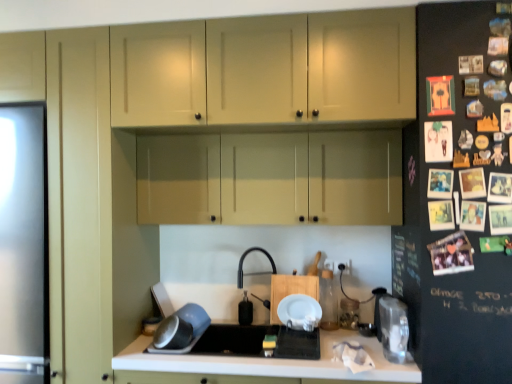
Question: Does white matte countertop at center appear on the left side of black rubber faucet at center?

Choices:
 (A) yes
 (B) no

Answer: (B)

Question: Are white matte countertop at center and black rubber faucet at center beside each other?

Choices:
 (A) no
 (B) yes

Answer: (A)

Question: From a real-world perspective, is white matte countertop at center under black rubber faucet at center?

Choices:
 (A) no
 (B) yes

Answer: (B)

Question: From a real-world perspective, does white matte countertop at center stand above black rubber faucet at center?

Choices:
 (A) no
 (B) yes

Answer: (A)

Question: Is white matte countertop at center smaller than black rubber faucet at center?

Choices:
 (A) no
 (B) yes

Answer: (A)

Question: Considering the positions of white matte countertop at center and matte beige cabinets at center, acting as the 2th cabinetry starting from the top, in the image, is white matte countertop at center bigger or smaller than matte beige cabinets at center, acting as the 2th cabinetry starting from the top,?

Choices:
 (A) small
 (B) big

Answer: (B)

Question: Does point (320, 350) appear closer or farther from the camera than point (260, 163)?

Choices:
 (A) farther
 (B) closer

Answer: (B)

Question: In the image, is white matte countertop at center positioned in front of or behind matte beige cabinets at center, acting as the 2th cabinetry starting from the top?

Choices:
 (A) behind
 (B) front

Answer: (B)

Question: From the image's perspective, is white matte countertop at center located above or below matte beige cabinets at center, acting as the 2th cabinetry starting from the top?

Choices:
 (A) below
 (B) above

Answer: (A)

Question: Is point (177, 332) closer or farther from the camera than point (449, 256)?

Choices:
 (A) closer
 (B) farther

Answer: (B)

Question: From the image's perspective, relative to black matte fridge at right, is metallic silver bowl at lower left, which is the 3th appliance from right to left, above or below?

Choices:
 (A) below
 (B) above

Answer: (A)

Question: In terms of width, does metallic silver bowl at lower left, placed as the first appliance when sorted from left to right, look wider or thinner when compared to black matte fridge at right?

Choices:
 (A) thin
 (B) wide

Answer: (A)

Question: Is metallic silver bowl at lower left, placed as the first appliance when sorted from left to right, in front of or behind black matte fridge at right in the image?

Choices:
 (A) behind
 (B) front

Answer: (A)

Question: In terms of size, does black matte sink at center appear bigger or smaller than white matte countertop at center?

Choices:
 (A) small
 (B) big

Answer: (A)

Question: Visually, is black matte sink at center positioned to the left or to the right of white matte countertop at center?

Choices:
 (A) right
 (B) left

Answer: (B)